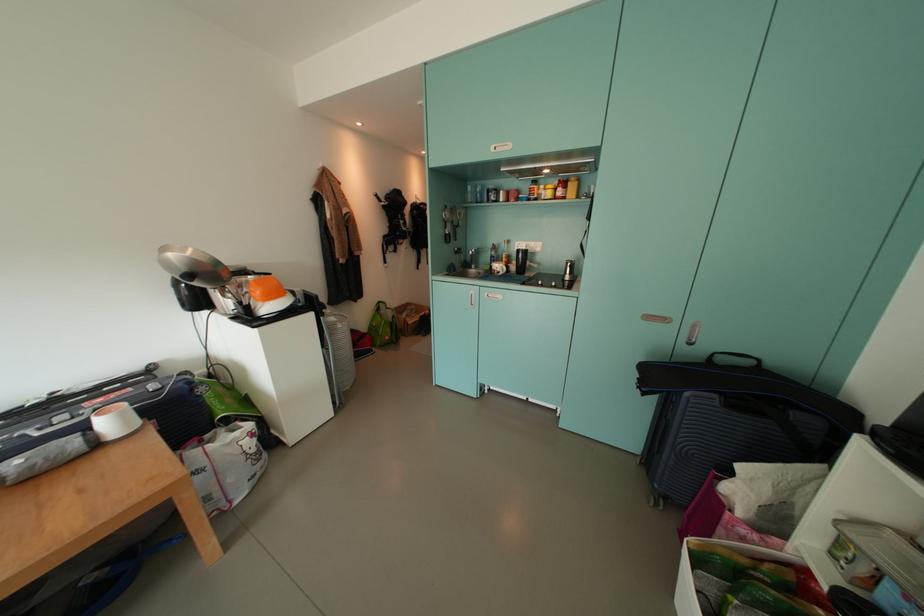
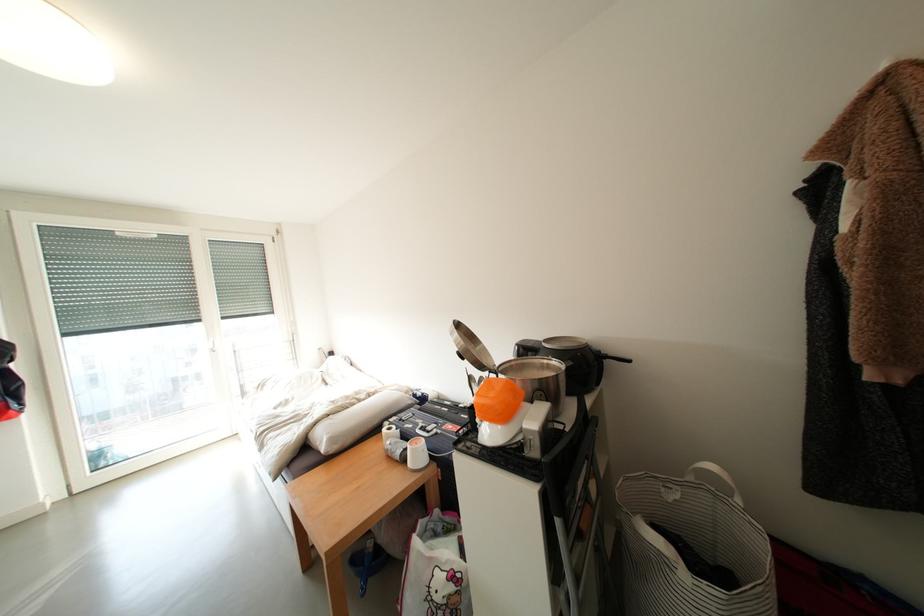
The point at (x=106, y=403) is marked in the first image. Where is the corresponding point in the second image?

(457, 430)